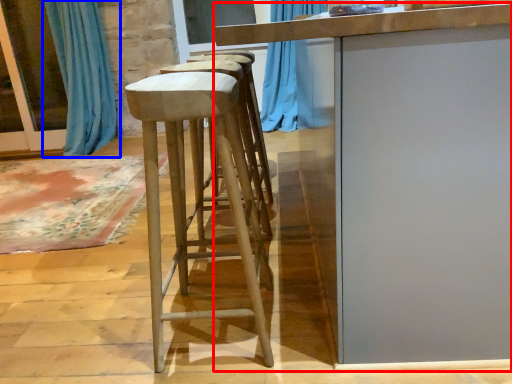
Question: Among these objects, which one is nearest to the camera, table (highlighted by a red box) or curtain (highlighted by a blue box)?

Choices:
 (A) table
 (B) curtain

Answer: (A)